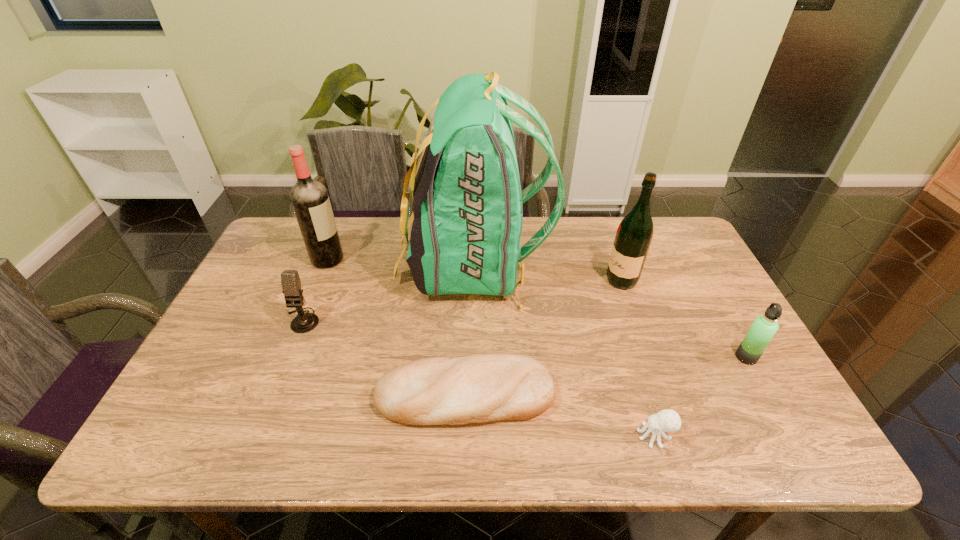
The height and width of the screenshot is (540, 960). Identify the location of liquor that is at the far edge. (310, 200).

Locate an element on the screen. This screenshot has width=960, height=540. bread that is positioned at the near edge is located at coordinates (479, 388).

The image size is (960, 540). Find the location of `octopus that is at the near edge`. octopus that is at the near edge is located at coordinates (667, 420).

In order to click on object at the right edge in this screenshot , I will do `click(764, 327)`.

Where is `free space at the far edge of the desktop`? This screenshot has height=540, width=960. free space at the far edge of the desktop is located at coordinates (348, 234).

In the image, there is a desktop. What are the coordinates of `free space at the near edge` in the screenshot? It's located at (305, 417).

This screenshot has height=540, width=960. Find the location of `vacant space at the left edge of the desktop`. vacant space at the left edge of the desktop is located at coordinates (256, 309).

You are a GUI agent. You are given a task and a screenshot of the screen. Output one action in this format:
    pyautogui.click(x=<x>, y=<y>)
    Task: Click on the vacant space at the right edge
    Image resolution: width=960 pixels, height=540 pixels.
    Given the screenshot: What is the action you would take?
    coord(719,379)

You are a GUI agent. You are given a task and a screenshot of the screen. Output one action in this format:
    pyautogui.click(x=<x>, y=<y>)
    Task: Click on the free location at the far left corner of the desktop
    
    Given the screenshot: What is the action you would take?
    pyautogui.click(x=290, y=231)

Where is `vacant region at the near left corner of the desktop`? vacant region at the near left corner of the desktop is located at coordinates (185, 421).